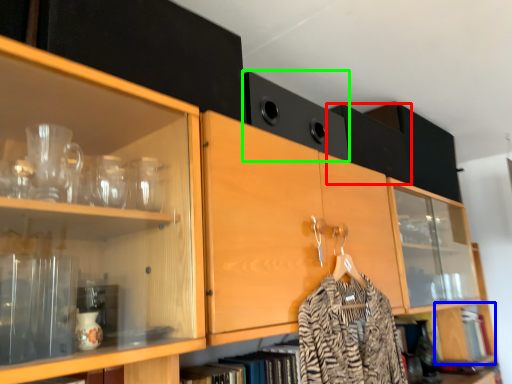
Question: Which object is the farthest from cabinetry (highlighted by a red box)? Choose among these: cabinetry (highlighted by a blue box) or cabinetry (highlighted by a green box).

Choices:
 (A) cabinetry
 (B) cabinetry

Answer: (A)